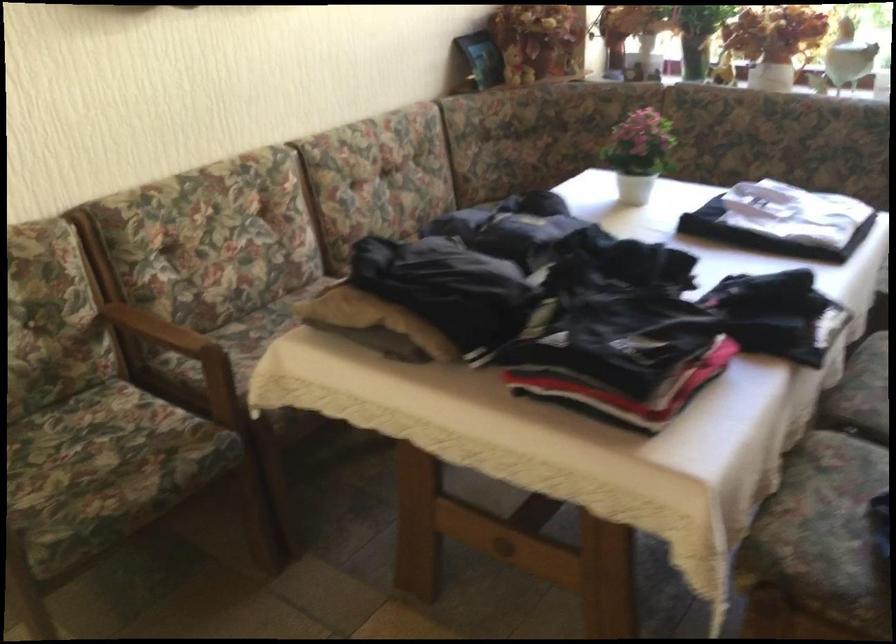
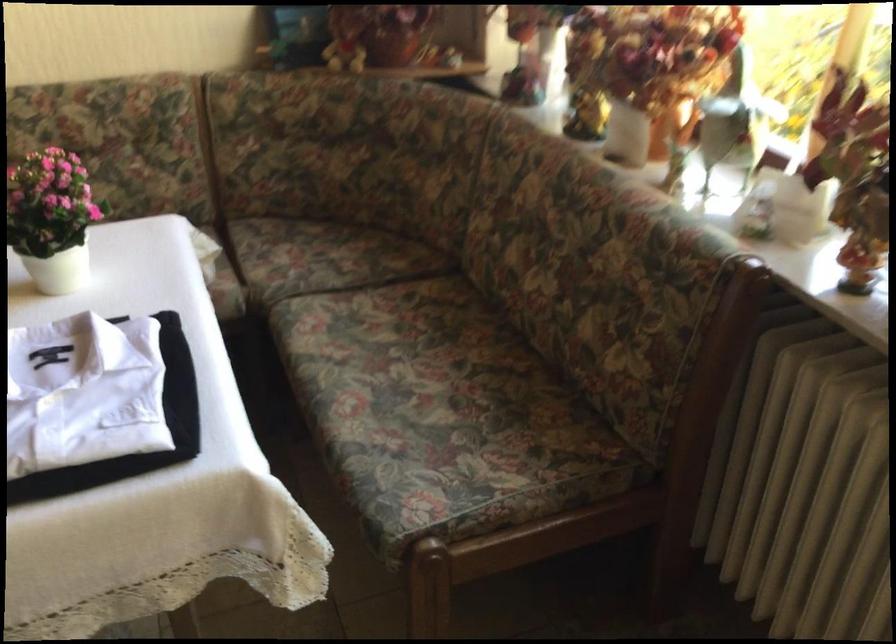
Locate, in the second image, the point that corresponds to (656,146) in the first image.

(52, 218)